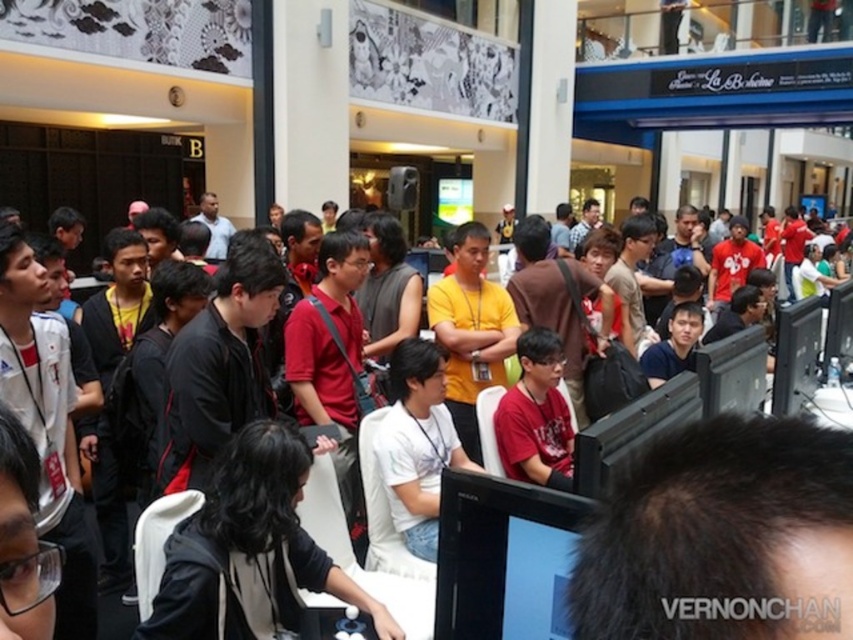
Question: Which point appears farthest from the camera in this image?

Choices:
 (A) (279, 428)
 (B) (439, 573)
 (C) (515, 417)

Answer: (C)

Question: Which point is closer to the camera?

Choices:
 (A) (251, 609)
 (B) (540, 516)
 (C) (553, 349)

Answer: (B)

Question: Is black fabric jacket at center wider than red matte shirt at center?

Choices:
 (A) no
 (B) yes

Answer: (B)

Question: Does black fabric jacket at center appear under red matte shirt at center?

Choices:
 (A) yes
 (B) no

Answer: (A)

Question: Which of the following is the closest to the observer?

Choices:
 (A) (225, 538)
 (B) (509, 600)
 (C) (563, 410)

Answer: (B)

Question: Is black fabric jacket at center bigger than black glossy monitor at center?

Choices:
 (A) yes
 (B) no

Answer: (A)